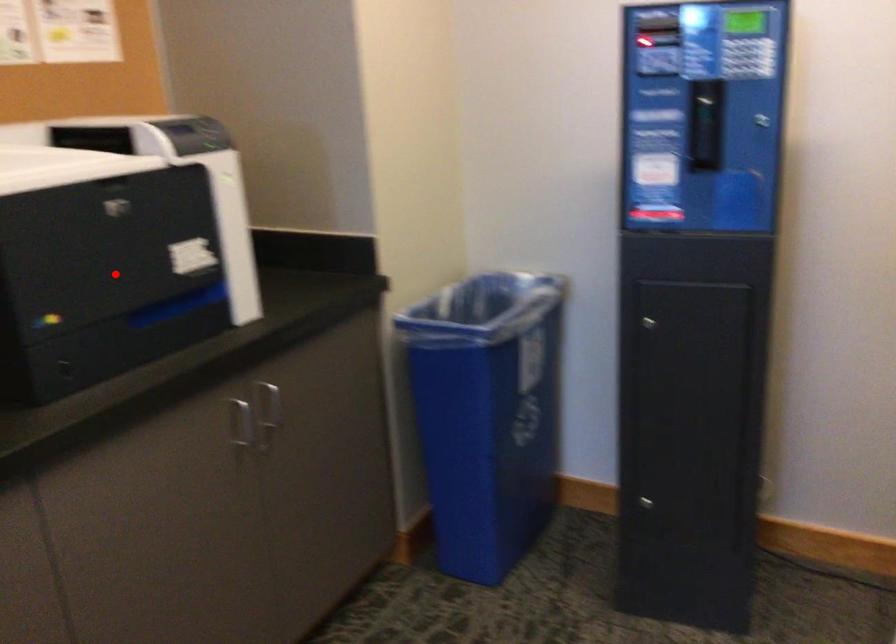
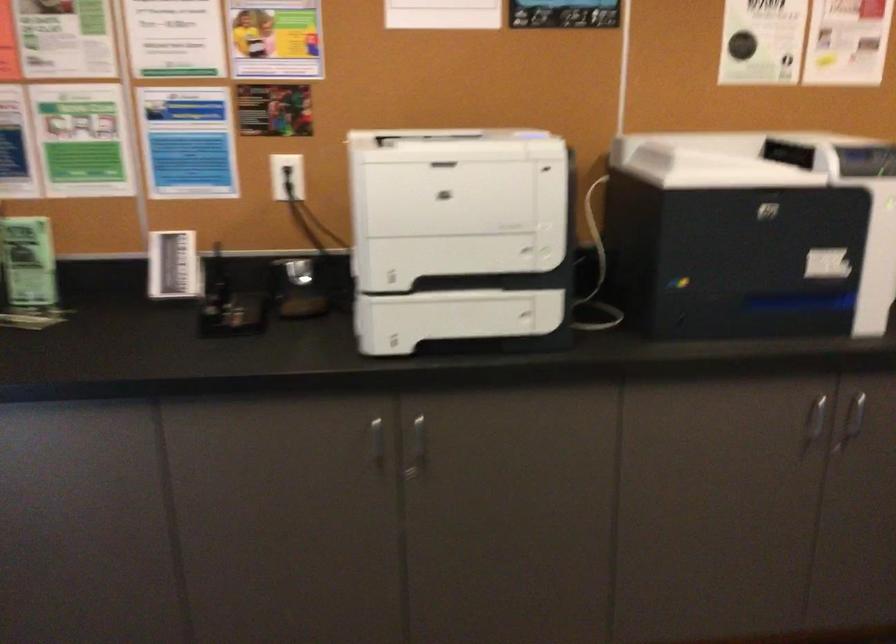
Question: I am providing you with two images of the same scene from different viewpoints. A red point is shown in image1. For the corresponding object point in image2, is it positioned nearer or farther from the camera?

Choices:
 (A) Nearer
 (B) Farther

Answer: (B)